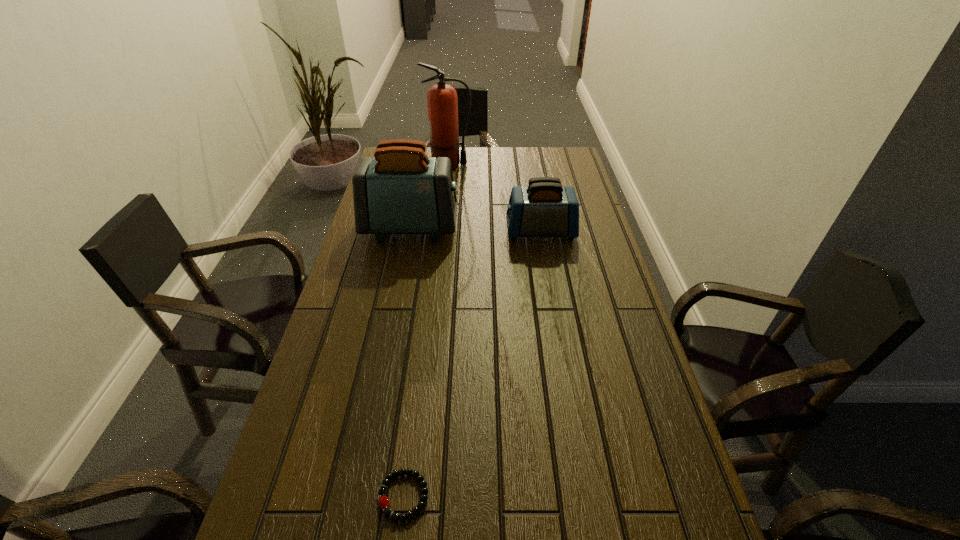
What are the coordinates of `vacant space at the far right corner of the desktop` in the screenshot? It's located at (544, 157).

Where is `free point between the third tallest object and the second tallest object`? free point between the third tallest object and the second tallest object is located at coordinates (475, 230).

Locate an element on the screen. free point between the fire extinguisher and the nearest object is located at coordinates (426, 330).

Identify the location of vacant area between the bracelet and the right toaster. (472, 363).

Locate an element on the screen. This screenshot has width=960, height=540. empty space that is in between the shortest object and the left toaster is located at coordinates (407, 362).

Find the location of `vacant area between the rightmost object and the tallest object`. vacant area between the rightmost object and the tallest object is located at coordinates (494, 198).

At what (x,y) coordinates should I click in order to perform the action: click on vacant region between the right toaster and the taller toaster. Please return your answer as a coordinate pair (x, y). The image size is (960, 540). Looking at the image, I should click on (475, 230).

Where is `vacant area that lies between the rightmost object and the taller toaster`? This screenshot has height=540, width=960. vacant area that lies between the rightmost object and the taller toaster is located at coordinates (475, 230).

The width and height of the screenshot is (960, 540). Identify the location of object that is the closest one to the second shortest object. click(401, 190).

Identify which object is the closest to the right toaster. Please provide its 2D coordinates. Your answer should be formatted as a tuple, i.e. [(x, y)], where the tuple contains the x and y coordinates of a point satisfying the conditions above.

[(401, 190)]